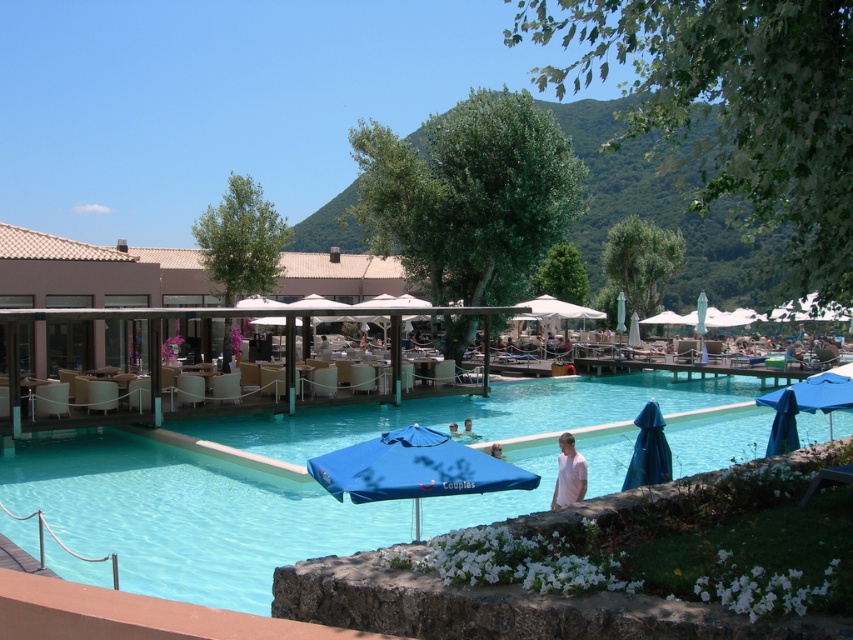
Consider the image. You are planning to place a new bench between the blue fabric umbrella at lower right and the light blue fabric umbrella at center. The bench requires 10 feet of space. Is there enough space between them to accommodate the bench?

The blue fabric umbrella at lower right is 23.26 feet from the light blue fabric umbrella at center. Since the bench requires 10 feet of space, there is more than enough space to place it between them.

You are planning to place a new bench in the pool area so that it can be under the blue fabric umbrella at lower right while still being near the blue glossy pool at center. Based on their positions, is this possible?

The blue glossy pool at center is below the blue fabric umbrella at lower right, so placing a bench under the umbrella would naturally position it near the pool as well. This arrangement is feasible.

You are planning to place a rectangular table that is 2 meters wide between the blue glossy pool at center and the blue fabric umbrella at lower right. Based on the scene description, can you determine if there is enough space to fit the table between them?

The blue glossy pool at center might be wider than blue fabric umbrella at lower right, but without exact measurements of their widths, it is uncertain if the 2 meter wide table can fit between them. Check the actual distance between the two objects before placing the table.